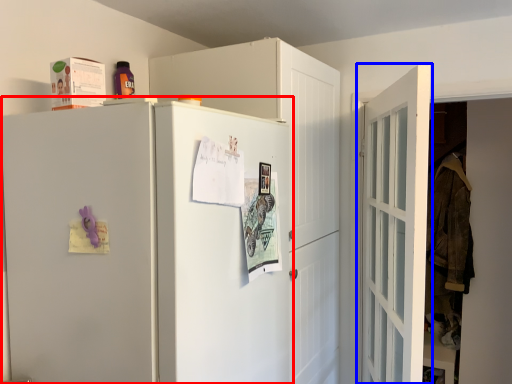
Question: Among these objects, which one is nearest to the camera, refrigerator (highlighted by a red box) or door (highlighted by a blue box)?

Choices:
 (A) refrigerator
 (B) door

Answer: (A)